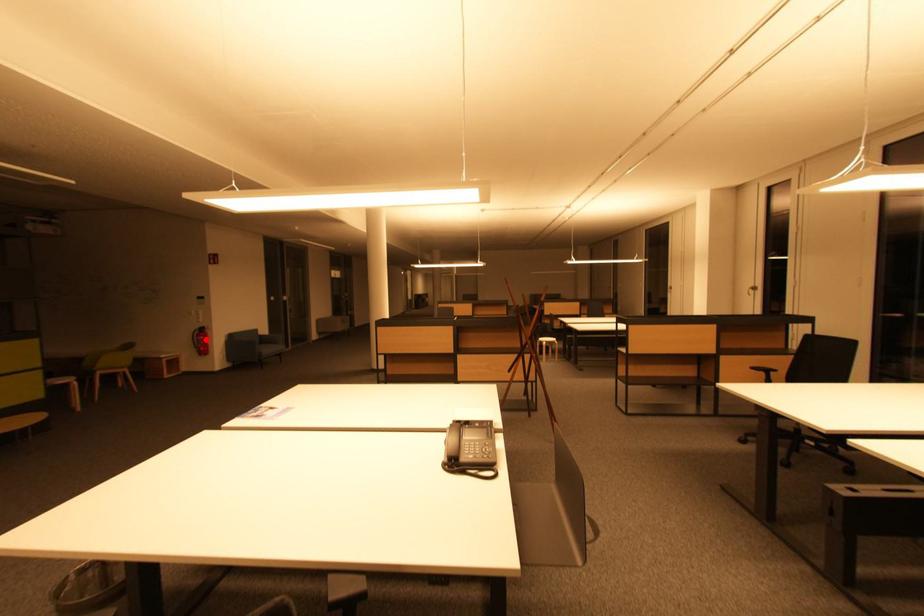
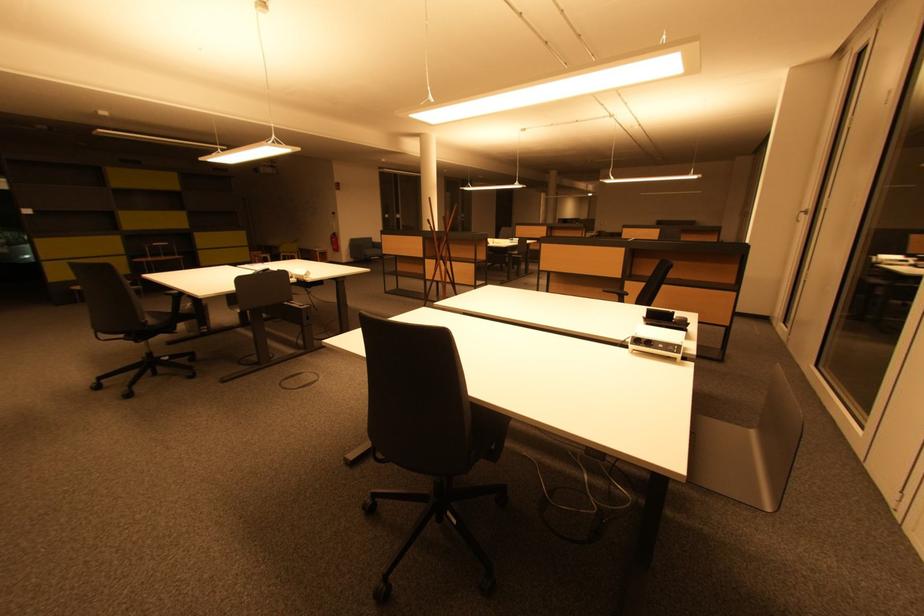
Question: A red point is marked in image1. In image2, is the corresponding 3D point closer to the camera or farther? Reply with the corresponding letter.

Choices:
 (A) The corresponding 3D point is closer.
 (B) The corresponding 3D point is farther.

Answer: (A)